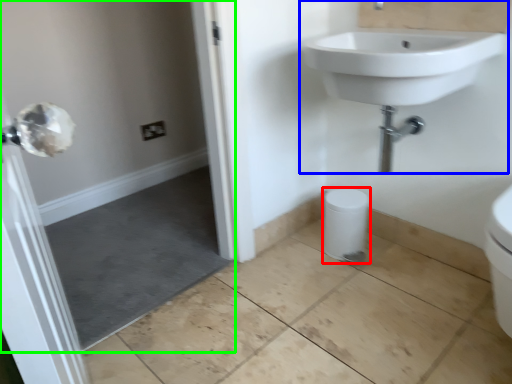
Question: Considering the real-world distances, which object is farthest from bidet (highlighted by a red box)? sink (highlighted by a blue box) or screen door (highlighted by a green box)?

Choices:
 (A) sink
 (B) screen door

Answer: (B)